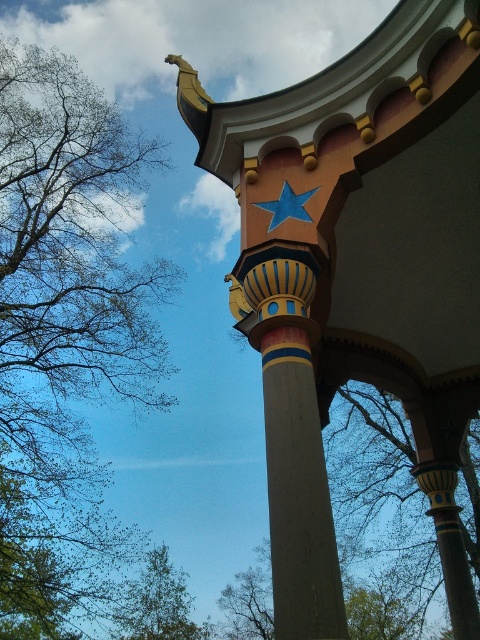
Is smooth concrete column at center closer to camera compared to green leafy tree at lower left?

Yes.

Can you confirm if smooth concrete column at center is positioned to the right of green leafy tree at lower left?

Correct, you'll find smooth concrete column at center to the right of green leafy tree at lower left.

Is point (291, 330) more distant than point (151, 616)?

That is False.

Where is `smooth concrete column at center`? This screenshot has height=640, width=480. smooth concrete column at center is located at coordinates (291, 440).

Which is in front, point (384, 280) or point (84, 435)?

Point (384, 280) is more forward.

The width and height of the screenshot is (480, 640). Describe the element at coordinates (359, 275) in the screenshot. I see `painted wood column at center` at that location.

Between point (470, 204) and point (48, 342), which one is positioned in front?

Point (470, 204) is in front.

In order to click on painted wood column at center in this screenshot , I will do click(359, 275).

Is green leafy tree at center to the left of green leafy tree at lower left from the viewer's perspective?

Incorrect, green leafy tree at center is not on the left side of green leafy tree at lower left.

Is green leafy tree at center further to camera compared to green leafy tree at lower left?

No.

Which is behind, point (476, 561) or point (137, 593)?

Positioned behind is point (137, 593).

What are the coordinates of `green leafy tree at center` in the screenshot? It's located at (407, 499).